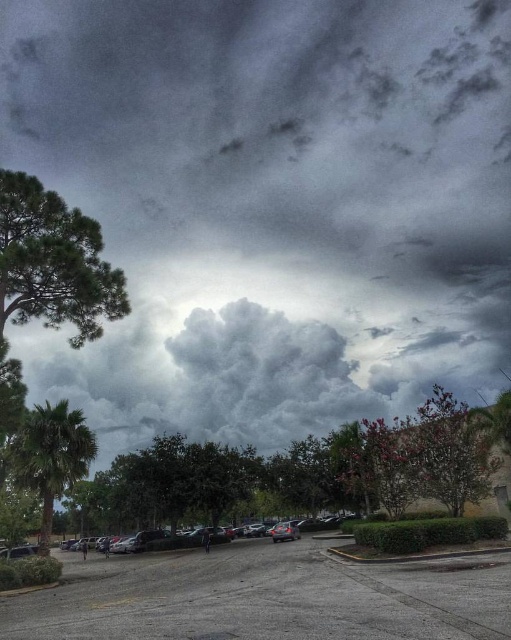
Question: Is green leafy tree at left above green leafy palm at left?

Choices:
 (A) no
 (B) yes

Answer: (B)

Question: Which point is closer to the camera taking this photo?

Choices:
 (A) (111, 636)
 (B) (20, 234)
 (C) (28, 417)

Answer: (A)

Question: Can you confirm if gray asphalt parking lot at lower center is thinner than green leafy tree at left?

Choices:
 (A) yes
 (B) no

Answer: (B)

Question: Is gray asphalt parking lot at lower center to the left of green leafy palm at left from the viewer's perspective?

Choices:
 (A) yes
 (B) no

Answer: (B)

Question: Which object is farther from the camera taking this photo?

Choices:
 (A) green leafy tree at left
 (B) gray fluffy cloud at upper center
 (C) gray asphalt parking lot at lower center
 (D) green leafy palm at left

Answer: (B)

Question: Among these points, which one is nearest to the camera?

Choices:
 (A) (64, 474)
 (B) (459, 605)

Answer: (B)